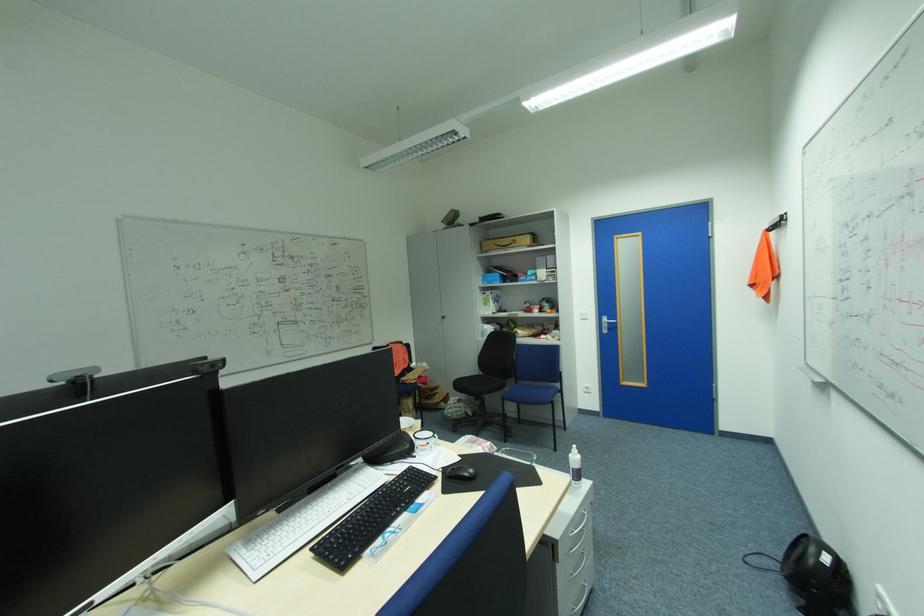
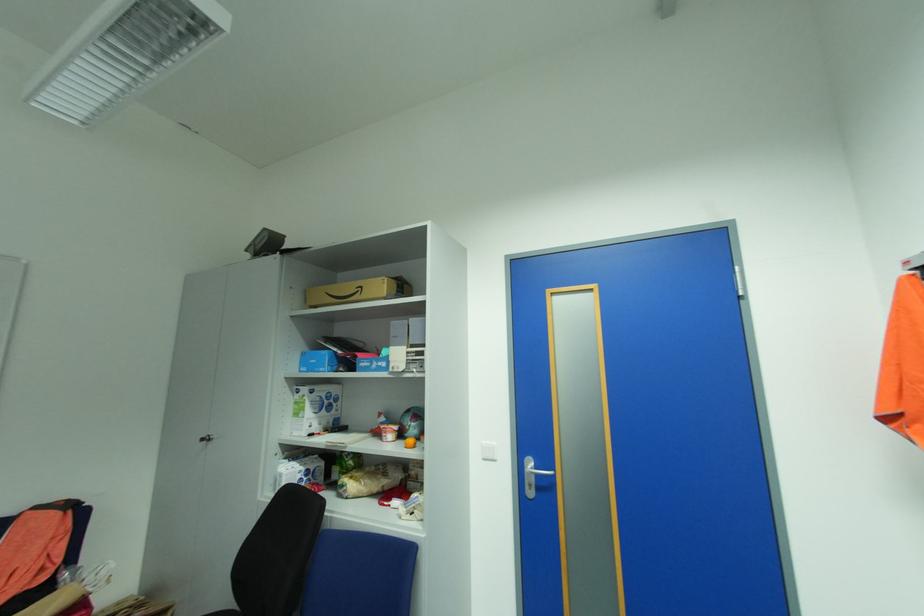
Locate, in the second image, the point that corresponds to the point at 503,283 in the first image.

(327, 370)